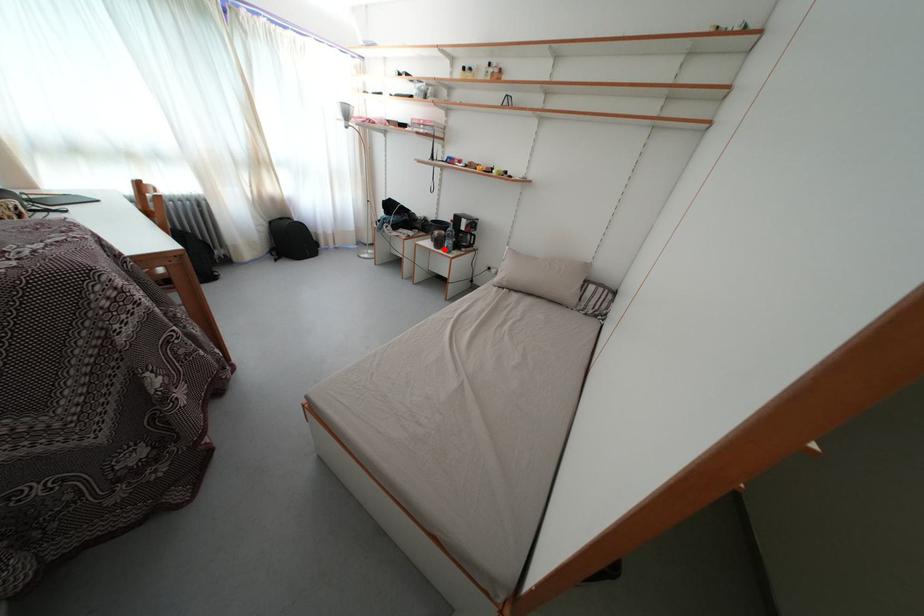
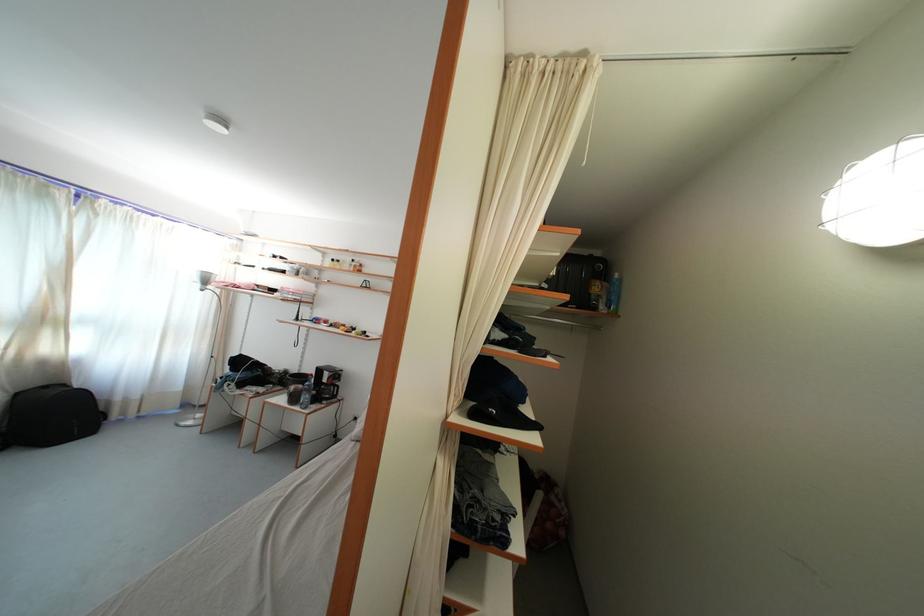
Where in the second image is the point corresponding to the highlighted location from the first image?

(300, 405)